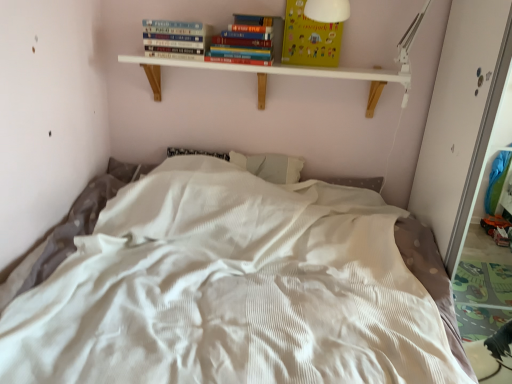
Question: Could you tell me if yellow paper at upper center is facing white textured bed at center?

Choices:
 (A) no
 (B) yes

Answer: (A)

Question: Does yellow paper at upper center appear on the right side of white textured bed at center?

Choices:
 (A) yes
 (B) no

Answer: (A)

Question: From the image's perspective, is yellow paper at upper center over white textured bed at center?

Choices:
 (A) yes
 (B) no

Answer: (A)

Question: Is yellow paper at upper center taller than white textured bed at center?

Choices:
 (A) no
 (B) yes

Answer: (A)

Question: Can you confirm if yellow paper at upper center is wider than white textured bed at center?

Choices:
 (A) no
 (B) yes

Answer: (A)

Question: From the image's perspective, is yellow paper at upper center above or below hardcover book at upper center?

Choices:
 (A) below
 (B) above

Answer: (B)

Question: From a real-world perspective, is yellow paper at upper center physically located above or below hardcover book at upper center?

Choices:
 (A) above
 (B) below

Answer: (A)

Question: Is point (338, 29) closer or farther from the camera than point (165, 36)?

Choices:
 (A) closer
 (B) farther

Answer: (B)

Question: In the image, is yellow paper at upper center on the left side or the right side of hardcover book at upper center?

Choices:
 (A) right
 (B) left

Answer: (A)

Question: From the image's perspective, relative to white textured bed at center, is yellow paper at upper center above or below?

Choices:
 (A) below
 (B) above

Answer: (B)

Question: Based on their sizes in the image, would you say yellow paper at upper center is bigger or smaller than white textured bed at center?

Choices:
 (A) big
 (B) small

Answer: (B)

Question: Considering their positions, is yellow paper at upper center located in front of or behind white textured bed at center?

Choices:
 (A) front
 (B) behind

Answer: (B)

Question: Is point (323, 39) closer or farther from the camera than point (300, 324)?

Choices:
 (A) closer
 (B) farther

Answer: (B)

Question: Is white wood shelf at upper center in front of or behind hardcover book at upper center in the image?

Choices:
 (A) behind
 (B) front

Answer: (B)

Question: Does point (408, 82) appear closer or farther from the camera than point (148, 36)?

Choices:
 (A) farther
 (B) closer

Answer: (B)